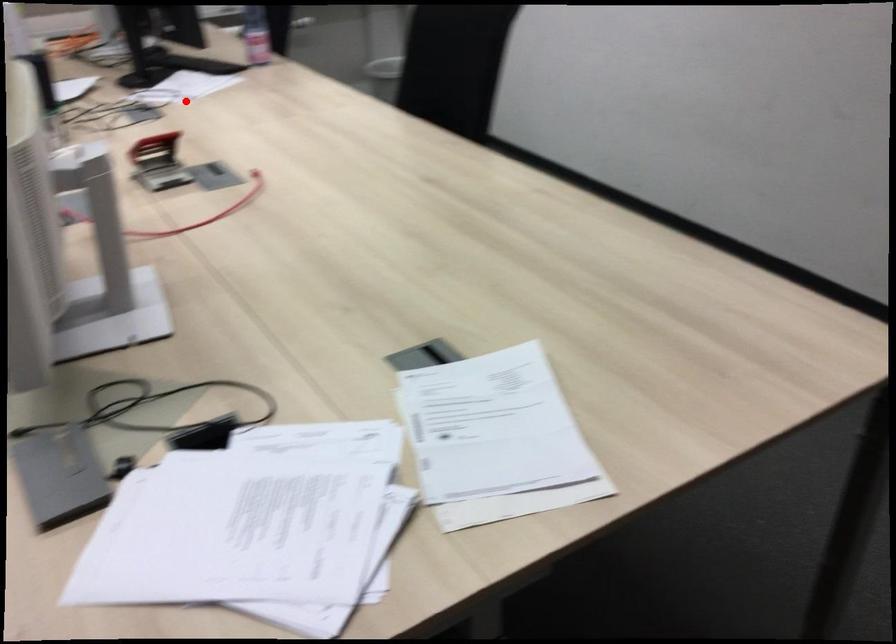
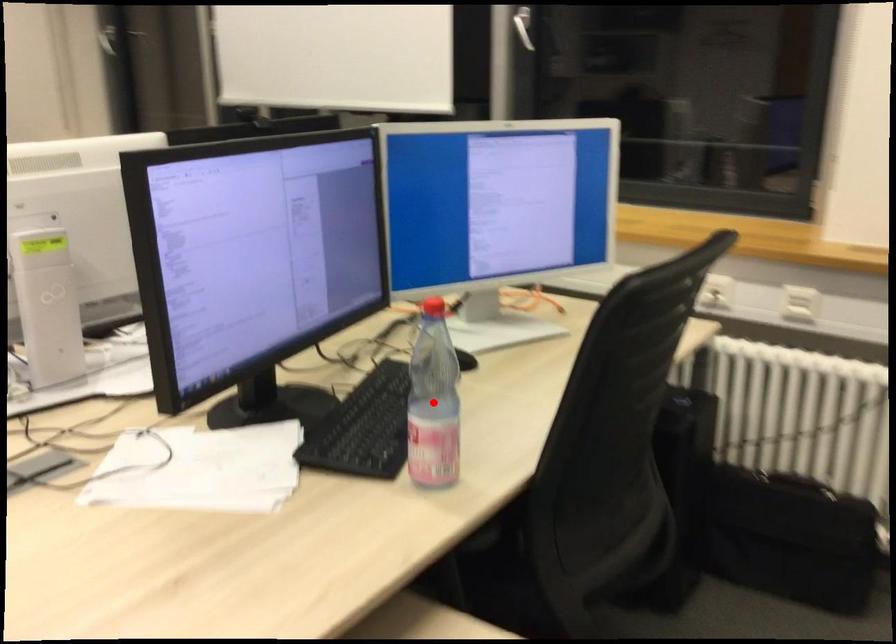
I am providing you with two images of the same scene from different viewpoints. A red point is marked on the first image and another point is marked on the second image. Does the point marked in image1 correspond to the same location as the one in image2?

No